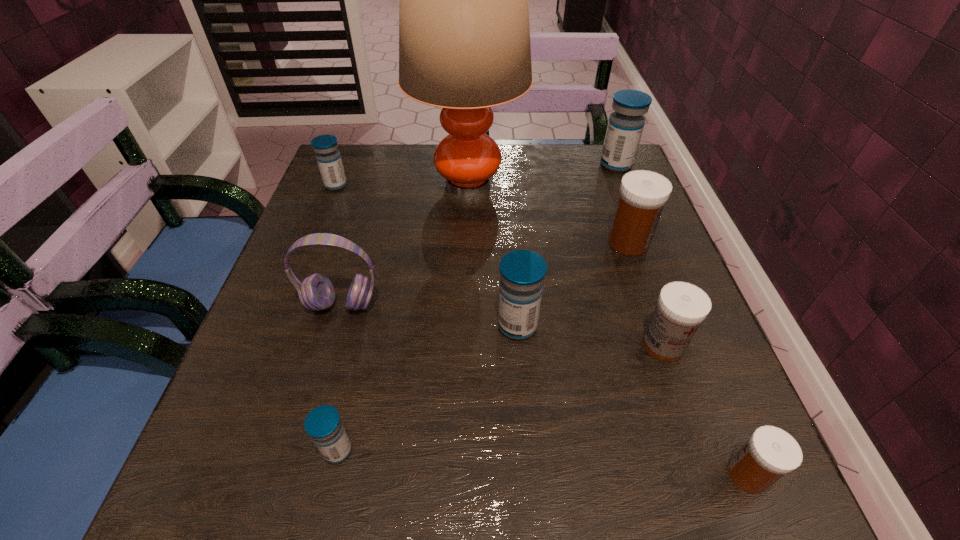
Where is `the leftmost blue medicine`? Image resolution: width=960 pixels, height=540 pixels. the leftmost blue medicine is located at coordinates (328, 157).

Identify the location of the second smallest white medicine. (681, 307).

Image resolution: width=960 pixels, height=540 pixels. What are the coordinates of `the nearest blue medicine` in the screenshot? It's located at (323, 424).

Locate an element on the screen. This screenshot has width=960, height=540. the second blue medicine from left to right is located at coordinates (323, 424).

Locate an element on the screen. the nearest white medicine is located at coordinates (770, 453).

In order to click on free space located 0.190m on the left of the tallest object in this screenshot , I will do `click(335, 185)`.

Where is `free space located on the front of the farthest blue medicine`? The image size is (960, 540). free space located on the front of the farthest blue medicine is located at coordinates pyautogui.click(x=657, y=268).

Where is `vacant space located 0.260m on the headband and ear cups of the headset`? This screenshot has height=540, width=960. vacant space located 0.260m on the headband and ear cups of the headset is located at coordinates (297, 464).

This screenshot has height=540, width=960. I want to click on blank space located 0.250m on the left of the third farthest medicine, so [x=490, y=242].

Image resolution: width=960 pixels, height=540 pixels. Identify the location of vacant space located 0.390m on the left of the fifth medicine from right to left. (278, 326).